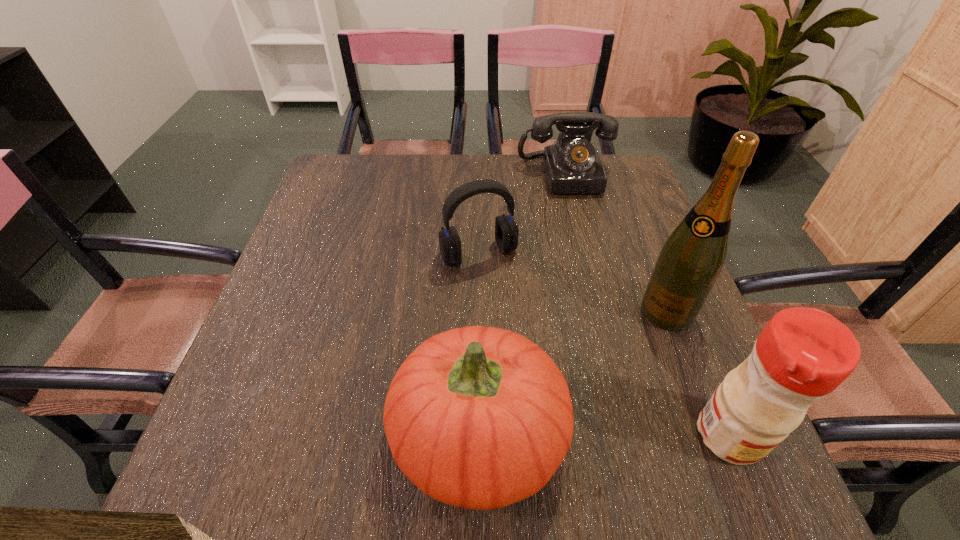
Where is `vacant space at the far left corner of the desktop`? The image size is (960, 540). vacant space at the far left corner of the desktop is located at coordinates (367, 181).

Where is `free spot between the third shortest object and the tallest object`? free spot between the third shortest object and the tallest object is located at coordinates (573, 373).

Find the location of a particular element. vacant region between the third tallest object and the shortest object is located at coordinates (522, 305).

At what (x,y) coordinates should I click in order to perform the action: click on free space between the pumpkin and the wine bottle. Please return your answer as a coordinate pair (x, y). The image size is (960, 540). Looking at the image, I should click on (573, 373).

Where is `empty location between the condiment and the third shortest object`? This screenshot has height=540, width=960. empty location between the condiment and the third shortest object is located at coordinates tap(604, 435).

Locate an element on the screen. The width and height of the screenshot is (960, 540). blank region between the farthest object and the wine bottle is located at coordinates (616, 243).

Locate an element on the screen. vacant area that lies between the wine bottle and the third shortest object is located at coordinates (573, 373).

At what (x,y) coordinates should I click in order to perform the action: click on unoccupied area between the third farthest object and the second tallest object. Please return your answer as a coordinate pair (x, y). This screenshot has height=540, width=960. Looking at the image, I should click on (698, 373).

Identify which object is the second closest to the condiment. Please provide its 2D coordinates. Your answer should be formatted as a tuple, i.e. [(x, y)], where the tuple contains the x and y coordinates of a point satisfying the conditions above.

[(478, 417)]

At what (x,y) coordinates should I click in order to perform the action: click on object that is the closest to the fourth nearest object. Please return your answer as a coordinate pair (x, y). This screenshot has width=960, height=540. Looking at the image, I should click on (572, 165).